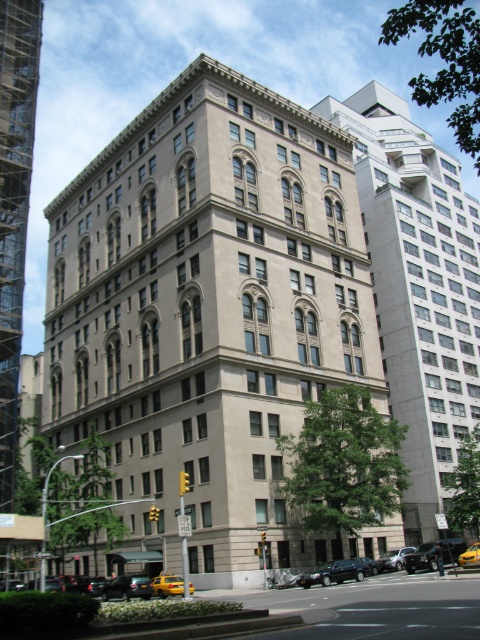
Can you confirm if black matte car at lower left is positioned to the left of yellow matte taxi cab at lower center?

Indeed, black matte car at lower left is positioned on the left side of yellow matte taxi cab at lower center.

Between black matte car at lower left and yellow matte taxi cab at lower center, which one has less height?

With less height is black matte car at lower left.

Between point (109, 586) and point (477, 564), which one is positioned behind?

Positioned behind is point (109, 586).

Locate an element on the screen. black matte car at lower left is located at coordinates (128, 586).

Looking at this image, does shiny black sedan at lower center have a larger size compared to black matte car at lower left?

Actually, shiny black sedan at lower center might be smaller than black matte car at lower left.

Is shiny black sedan at lower center wider than black matte car at lower left?

Incorrect, shiny black sedan at lower center's width does not surpass black matte car at lower left's.

Is point (327, 579) in front of point (117, 589)?

Yes, it is.

Image resolution: width=480 pixels, height=640 pixels. What are the coordinates of `shiny black sedan at lower center` in the screenshot? It's located at (333, 572).

Is yellow rubber taxi at lower center wider than shiny silver sedan at center?

Indeed, yellow rubber taxi at lower center has a greater width compared to shiny silver sedan at center.

Does yellow rubber taxi at lower center lie behind shiny silver sedan at center?

No, it is not.

Does point (164, 582) lie behind point (398, 552)?

No.

At what (x,y) coordinates should I click in order to perform the action: click on yellow rubber taxi at lower center. Please return your answer as a coordinate pair (x, y). The image size is (480, 640). Looking at the image, I should click on (168, 586).